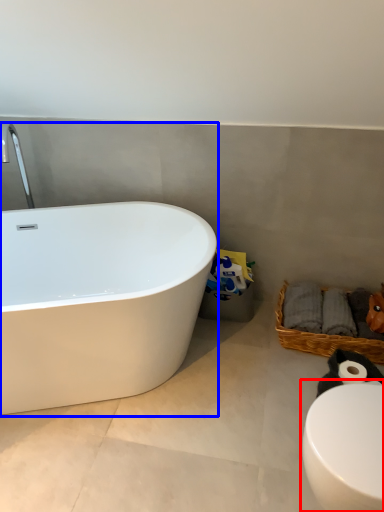
Question: Which object appears farthest to the camera in this image, toilet (highlighted by a red box) or bathtub (highlighted by a blue box)?

Choices:
 (A) toilet
 (B) bathtub

Answer: (B)